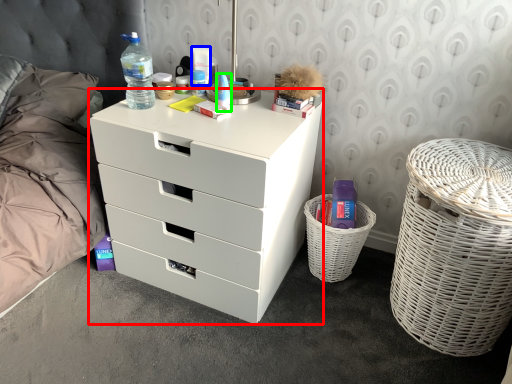
Question: Considering the real-world distances, which object is farthest from chest of drawers (highlighted by a red box)? toiletry (highlighted by a blue box) or toiletry (highlighted by a green box)?

Choices:
 (A) toiletry
 (B) toiletry

Answer: (A)